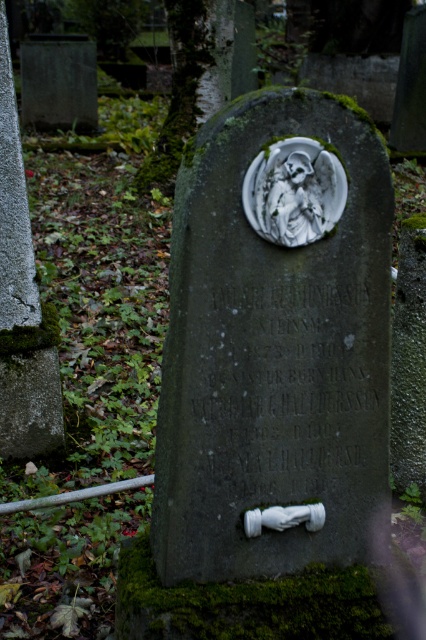
Looking at this image, which of these two, green mossy stone at center or white stone angel at center, stands shorter?

Standing shorter between the two is white stone angel at center.

Which of these two, green mossy stone at center or white stone angel at center, stands taller?

green mossy stone at center

Between point (322, 381) and point (310, 211), which one is positioned behind?

The point (322, 381) is more distant.

At what (x,y) coordinates should I click in order to perform the action: click on green mossy stone at center. Please return your answer as a coordinate pair (x, y). Looking at the image, I should click on (275, 340).